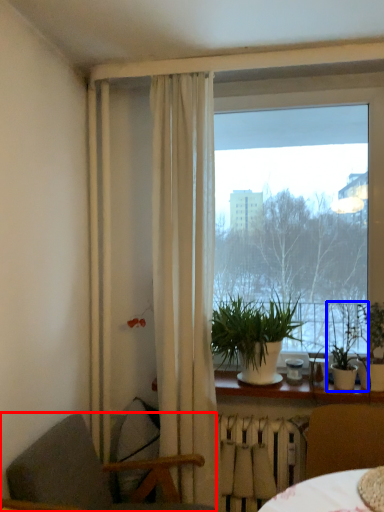
Question: Which object is closer to the camera taking this photo, chair (highlighted by a red box) or houseplant (highlighted by a blue box)?

Choices:
 (A) chair
 (B) houseplant

Answer: (A)